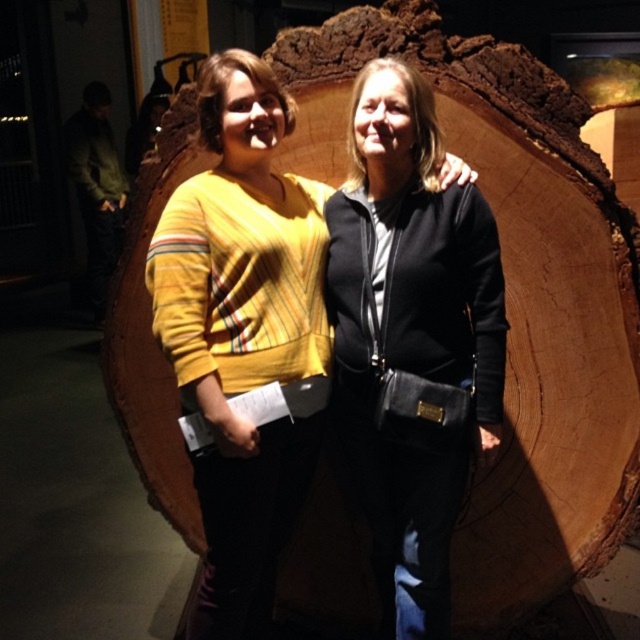
You are standing in a room with two people in front of a tree trunk. You need to hand a gift to the person wearing the matte yellow sweater at center without disturbing the person in the black leather jacket at center. Which direction should you approach from?

You should approach from the left side of the matte yellow sweater at center because the black leather jacket at center is to the right of it, so approaching from the left avoids the person in the black leather jacket at center.

You are standing in front of the tree trunk and want to place a small gift exactly where the black leather jacket at center is located. What coordinates should you aim for?

You should aim for the coordinates point (412,339) where the black leather jacket at center is located.